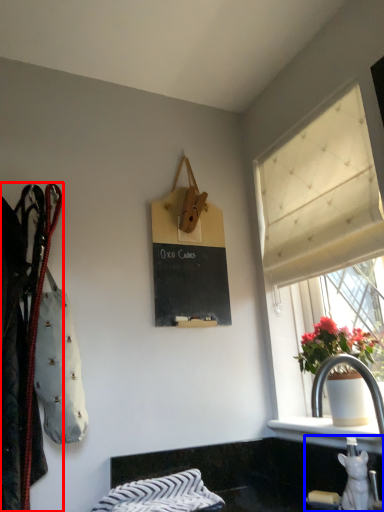
Question: Which object is closer to the camera taking this photo, closet (highlighted by a red box) or sink (highlighted by a blue box)?

Choices:
 (A) closet
 (B) sink

Answer: (A)